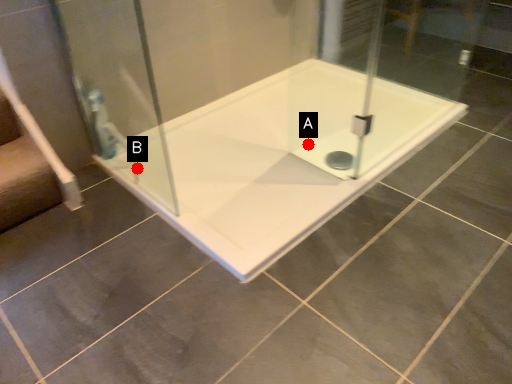
Question: Two points are circled on the image, labeled by A and B beside each circle. Which point is further to the camera?

Choices:
 (A) A is further
 (B) B is further

Answer: (A)